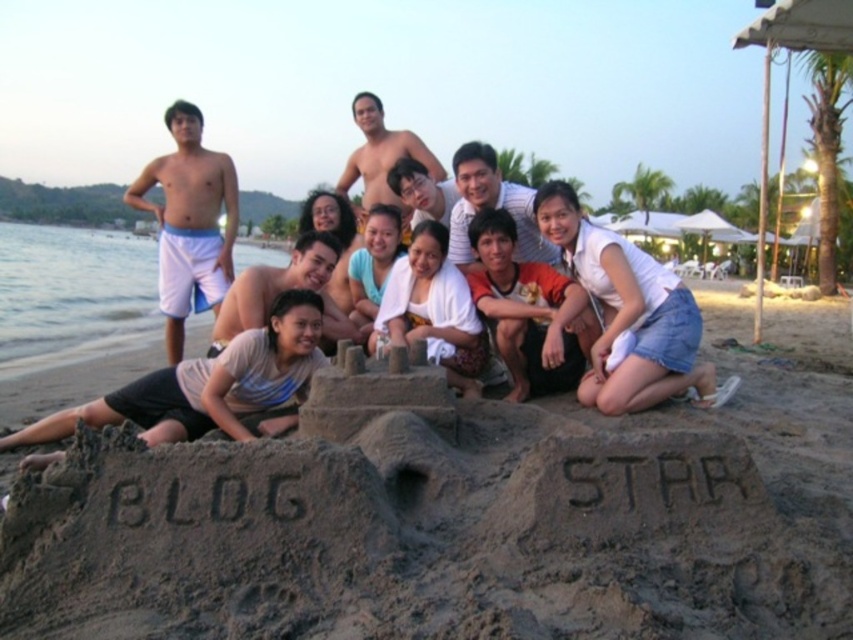
Is white cotton shirt at lower center bigger than white towel at center?

Incorrect, white cotton shirt at lower center is not larger than white towel at center.

Who is shorter, white cotton shirt at lower center or white towel at center?

white towel at center

In order to click on white cotton shirt at lower center in this screenshot , I will do `click(527, 310)`.